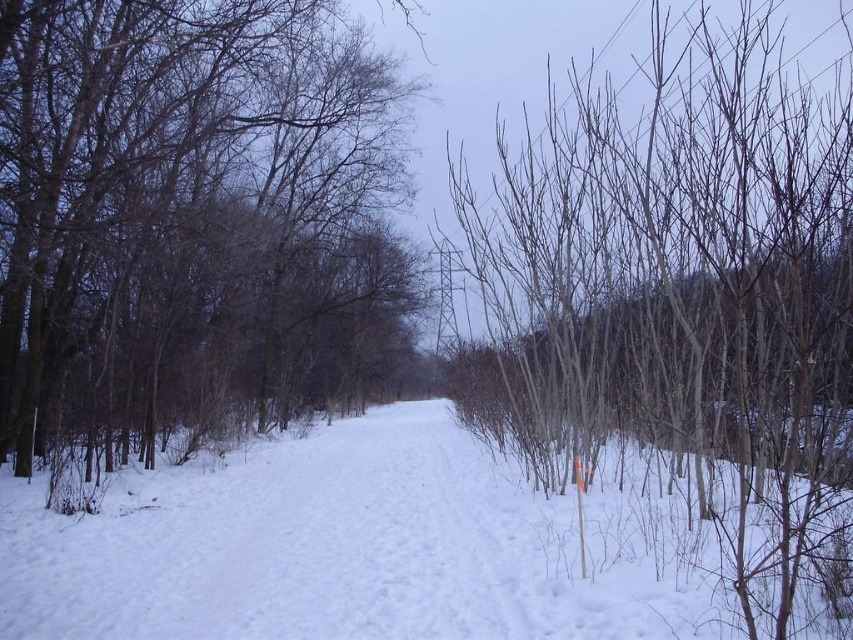
Can you confirm if smooth bark trees at right is smaller than white powdery snow at center?

Incorrect, smooth bark trees at right is not smaller in size than white powdery snow at center.

Is smooth bark trees at right positioned at the back of white powdery snow at center?

No, it is not.

Measure the distance between smooth bark trees at right and camera.

smooth bark trees at right is 2.45 meters away from camera.

This screenshot has height=640, width=853. In order to click on smooth bark trees at right in this screenshot , I will do `click(683, 304)`.

Is smooth bark tree at center to the right of smooth bark trees at right from the viewer's perspective?

No, smooth bark tree at center is not to the right of smooth bark trees at right.

Locate an element on the screen. Image resolution: width=853 pixels, height=640 pixels. smooth bark tree at center is located at coordinates (194, 225).

Where is `smooth bark tree at center`? The width and height of the screenshot is (853, 640). smooth bark tree at center is located at coordinates (194, 225).

Which is in front, point (22, 368) or point (476, 513)?

Point (476, 513)

Identify the location of smooth bark tree at center. (194, 225).